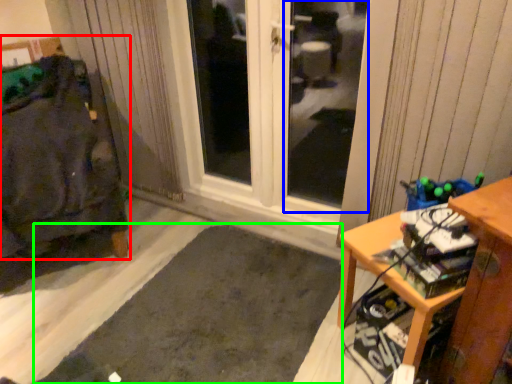
Question: Which is farther away from furniture (highlighted by a red box)? window screen (highlighted by a blue box) or doormat (highlighted by a green box)?

Choices:
 (A) window screen
 (B) doormat

Answer: (A)